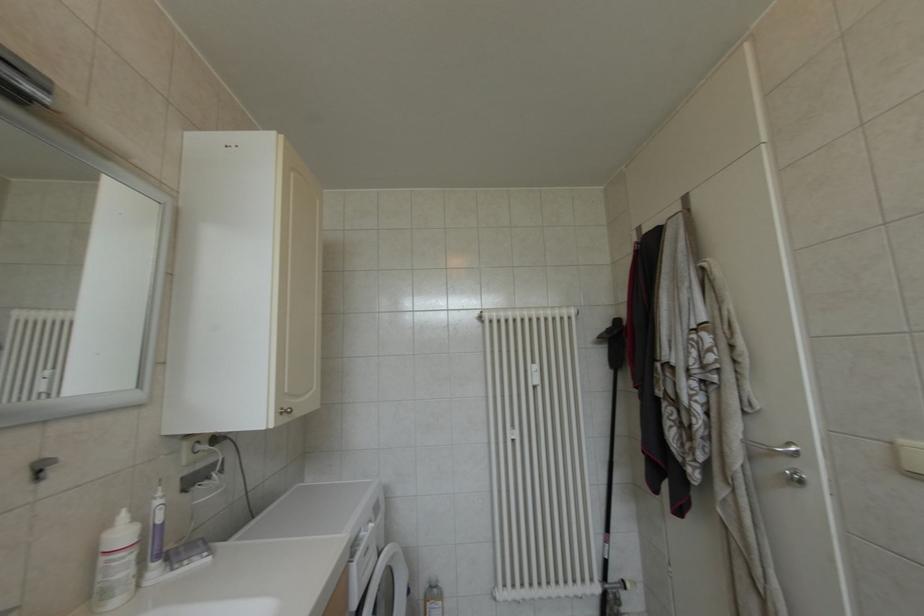
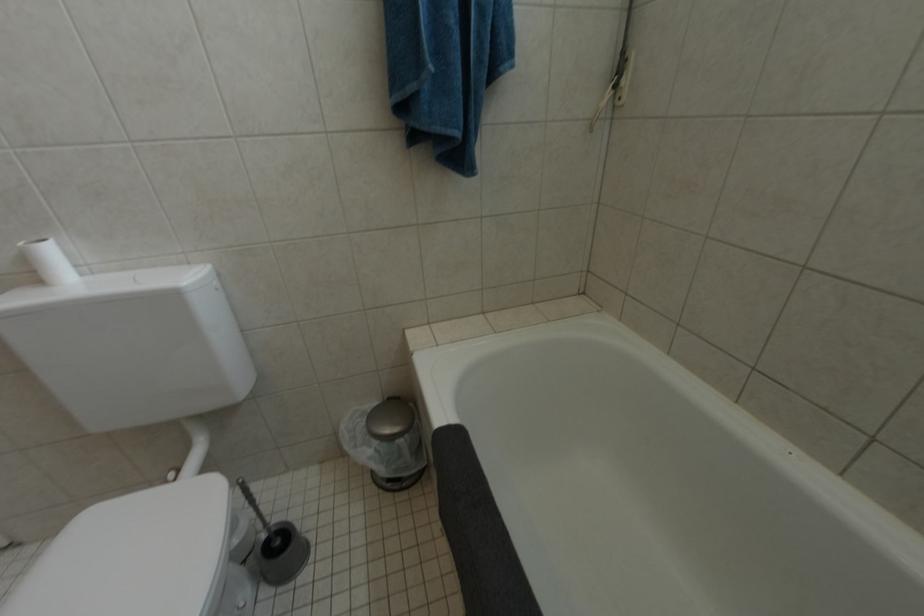
Based on the continuous images, in which direction is the camera rotating?

The camera rotated toward right-down.